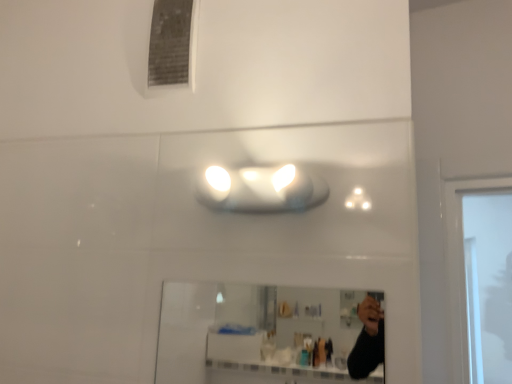
Question: From the image's perspective, is clear glass mirror at center positioned above or below white glossy light fixture at center?

Choices:
 (A) below
 (B) above

Answer: (A)

Question: From a real-world perspective, relative to white glossy light fixture at center, is clear glass mirror at center vertically above or below?

Choices:
 (A) above
 (B) below

Answer: (B)

Question: In terms of height, does clear glass mirror at center look taller or shorter compared to white glossy light fixture at center?

Choices:
 (A) short
 (B) tall

Answer: (B)

Question: Relative to clear glass mirror at center, is white glossy light fixture at center in front or behind?

Choices:
 (A) behind
 (B) front

Answer: (A)

Question: Looking at their shapes, would you say white glossy light fixture at center is wider or thinner than clear glass mirror at center?

Choices:
 (A) thin
 (B) wide

Answer: (B)

Question: From the image's perspective, relative to clear glass mirror at center, is white glossy light fixture at center above or below?

Choices:
 (A) below
 (B) above

Answer: (B)

Question: Considering the positions of point click(x=307, y=173) and point click(x=368, y=377), is point click(x=307, y=173) closer or farther from the camera than point click(x=368, y=377)?

Choices:
 (A) farther
 (B) closer

Answer: (B)